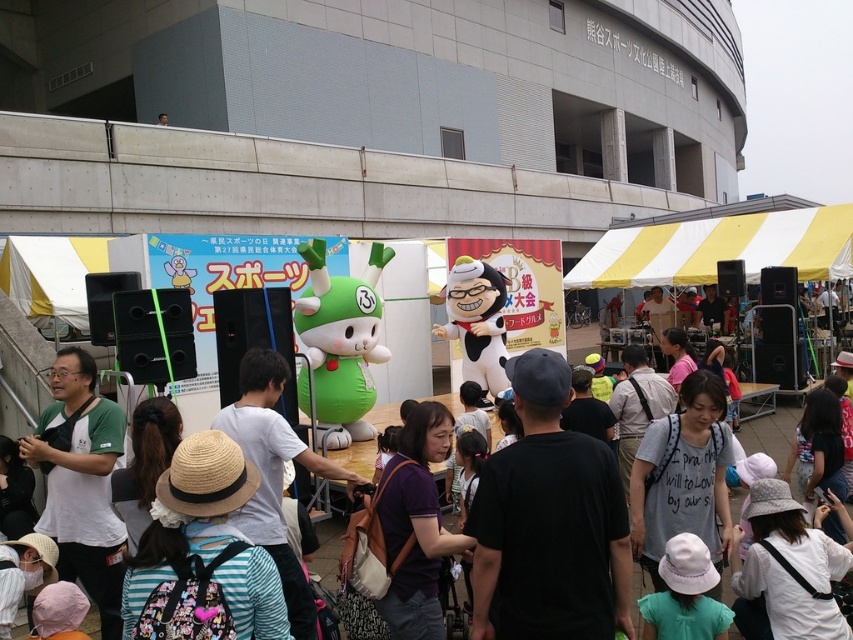
This screenshot has width=853, height=640. Describe the element at coordinates (720, 248) in the screenshot. I see `yellow/white striped canopy at center` at that location.

Is yellow/white striped canopy at center positioned in front of matte green plush toy at center?

No, it is not.

Does point (598, 276) come farther from viewer compared to point (587, 330)?

No, it is in front of (587, 330).

At what (x,y) coordinates should I click in order to perform the action: click on yellow/white striped canopy at center. Please return your answer as a coordinate pair (x, y). The width and height of the screenshot is (853, 640). Looking at the image, I should click on (720, 248).

Is black matte shirt at center taller than matte green plush toy at center?

No, black matte shirt at center is not taller than matte green plush toy at center.

Which is above, black matte shirt at center or matte green plush toy at center?

Positioned higher is black matte shirt at center.

The height and width of the screenshot is (640, 853). I want to click on black matte shirt at center, so click(549, 522).

How far apart are black matte shirt at center and yellow/white striped canopy at center?

The distance of black matte shirt at center from yellow/white striped canopy at center is 14.08 meters.

Is point (479, 608) more distant than point (668, 284)?

No, (479, 608) is closer to viewer.

Is point (564, 502) positioned behind point (606, 240)?

That is False.

Where is `black matte shirt at center`? This screenshot has width=853, height=640. black matte shirt at center is located at coordinates (549, 522).